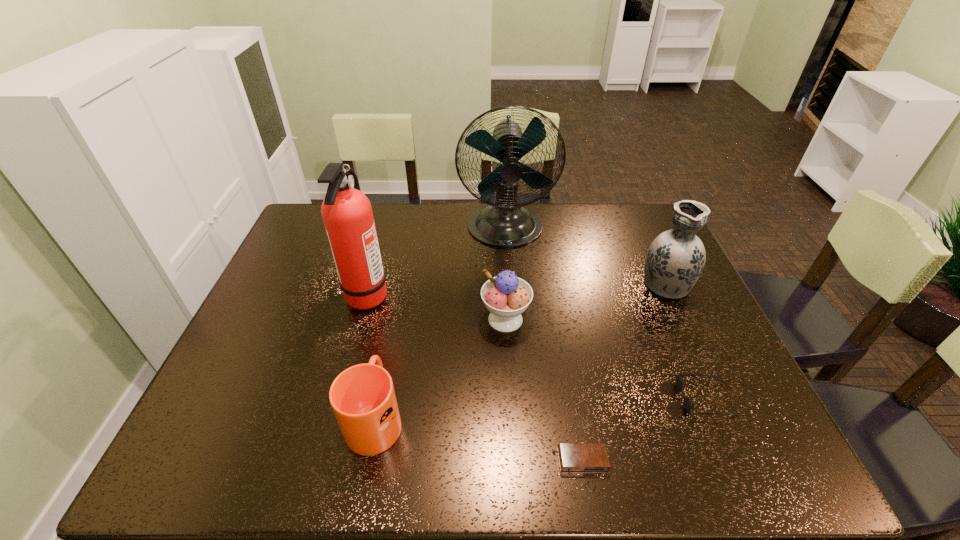
Locate an element on the screen. The width and height of the screenshot is (960, 540). vacant area situated with the handle on the side of the fifth shortest object is located at coordinates (645, 239).

Where is `vacant space located with the handle on the side of the fifth shortest object`? This screenshot has height=540, width=960. vacant space located with the handle on the side of the fifth shortest object is located at coordinates (645, 239).

Image resolution: width=960 pixels, height=540 pixels. What are the coordinates of `free space located on the back of the icecream` in the screenshot? It's located at (500, 222).

Locate an element on the screen. The height and width of the screenshot is (540, 960). free point located 0.400m on the handle side of the mug is located at coordinates (403, 272).

Where is `free space located 0.370m on the handle side of the mug`? free space located 0.370m on the handle side of the mug is located at coordinates (402, 278).

This screenshot has width=960, height=540. What are the coordinates of `free point located on the handle side of the mug` in the screenshot? It's located at (392, 332).

This screenshot has height=540, width=960. Identify the location of free space located 0.340m on the front-facing side of the sunglasses. (531, 399).

Locate an element on the screen. The height and width of the screenshot is (540, 960). vacant space located 0.360m on the front-facing side of the sunglasses is located at coordinates (522, 399).

What are the coordinates of `free space located 0.070m on the front-facing side of the sunglasses` in the screenshot? It's located at tap(649, 399).

Find the location of a particular element. The width and height of the screenshot is (960, 540). object located at the far edge is located at coordinates (505, 223).